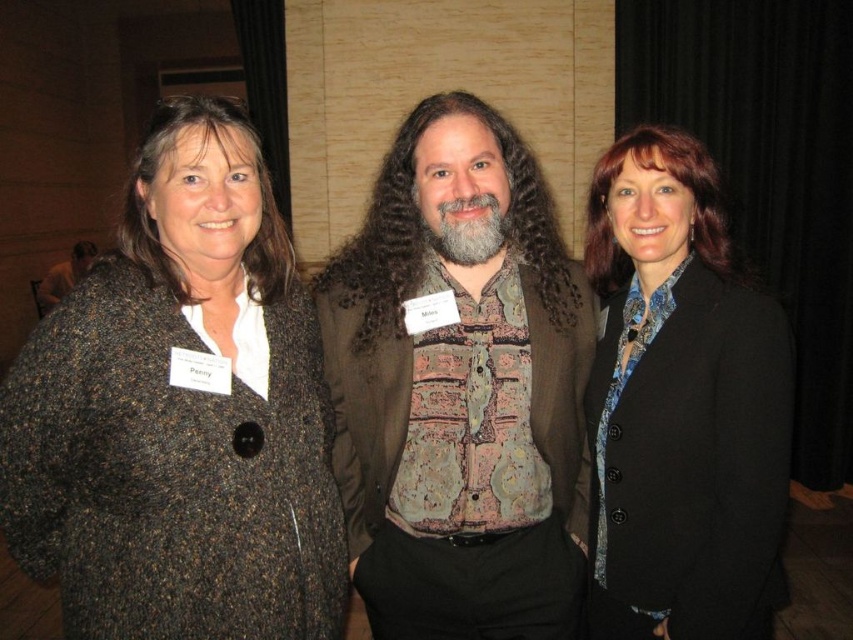
Question: Is the position of knitted brown coat at left more distant than that of brown textured coat at center?

Choices:
 (A) no
 (B) yes

Answer: (A)

Question: Which of these objects is positioned closest to the paisley fabric shirt at center?

Choices:
 (A) brown textured coat at center
 (B) knitted brown coat at left

Answer: (B)

Question: Does knitted brown coat at left have a smaller size compared to brown textured coat at center?

Choices:
 (A) no
 (B) yes

Answer: (B)

Question: Does graywoollybeard at center have a lesser width compared to brown textured coat at center?

Choices:
 (A) no
 (B) yes

Answer: (B)

Question: Which of the following is the closest to the observer?

Choices:
 (A) knitted brown coat at left
 (B) black textured blazer at center
 (C) graywoollybeard at center

Answer: (A)

Question: Which point is closer to the camera?

Choices:
 (A) paisley fabric shirt at center
 (B) brown textured coat at center

Answer: (A)